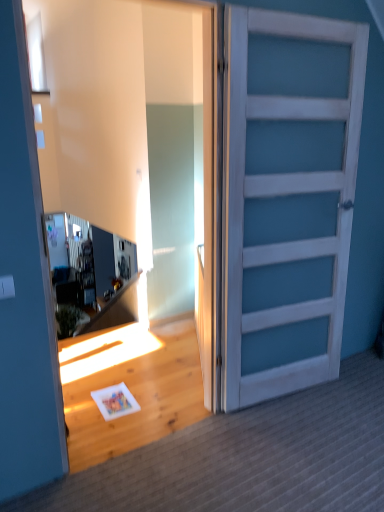
Identify the location of vacant area that is in front of white wooden door at right. (296, 444).